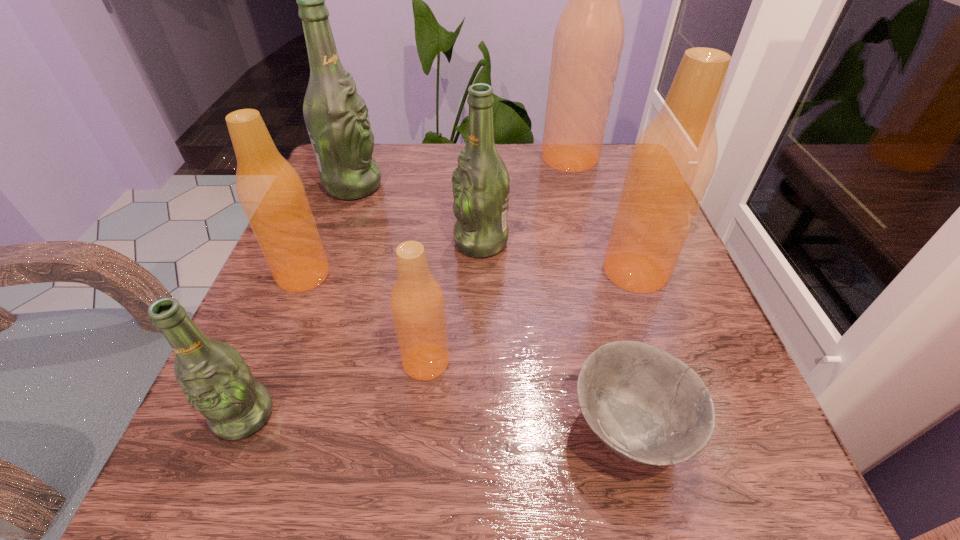
The width and height of the screenshot is (960, 540). In order to click on the biggest tan beer bottle in this screenshot , I will do `click(588, 41)`.

The width and height of the screenshot is (960, 540). In order to click on the farthest tan beer bottle in this screenshot , I will do `click(588, 41)`.

Locate an element on the screen. the farthest green beer bottle is located at coordinates (336, 116).

Find the location of a particular element. the third smallest tan beer bottle is located at coordinates (673, 161).

Find the location of `the second nearest green beer bottle`. the second nearest green beer bottle is located at coordinates (481, 183).

Locate an element on the screen. the second biggest green beer bottle is located at coordinates (481, 183).

The height and width of the screenshot is (540, 960). What are the coordinates of `the third biggest tan beer bottle` in the screenshot? It's located at (271, 193).

At what (x,y) coordinates should I click in order to perform the action: click on the nearest tan beer bottle. Please return your answer as a coordinate pair (x, y). This screenshot has height=540, width=960. Looking at the image, I should click on (417, 303).

The height and width of the screenshot is (540, 960). Find the location of `the second tan beer bottle from left to right`. the second tan beer bottle from left to right is located at coordinates (417, 303).

Identify the location of the nearest beer bottle. (216, 381).